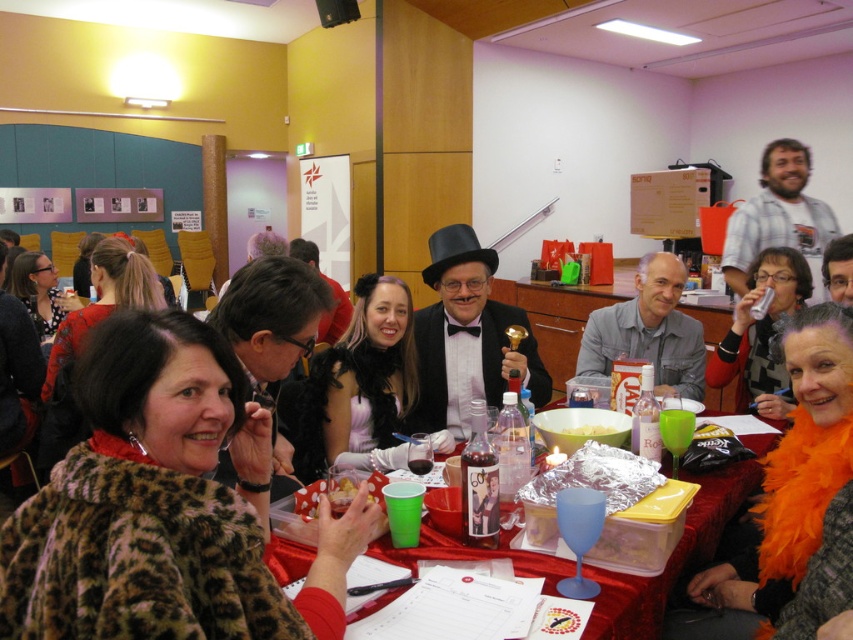
Is matte black dress at center below matte black coat at lower left?

Indeed, matte black dress at center is positioned under matte black coat at lower left.

Can you confirm if matte black dress at center is smaller than matte black coat at lower left?

Yes, matte black dress at center is smaller than matte black coat at lower left.

Which is behind, point (390, 465) or point (62, 308)?

Point (62, 308)

This screenshot has width=853, height=640. In order to click on matte black dress at center in this screenshot , I will do `click(358, 380)`.

Can you confirm if leopard print coat at lower left is thinner than orange feather boa at center?

Incorrect, leopard print coat at lower left's width is not less than orange feather boa at center's.

Is leopard print coat at lower left wider than orange feather boa at center?

Indeed, leopard print coat at lower left has a greater width compared to orange feather boa at center.

Measure the distance between leopard print coat at lower left and camera.

They are 29.46 inches apart.

Find the location of `leopard print coat at lower left`. leopard print coat at lower left is located at coordinates (165, 506).

Between point (640, 625) and point (36, 317), which one is positioned in front?

Positioned in front is point (640, 625).

Is translucent plastic cups at center positioned behind matte black coat at lower left?

No, it is in front of matte black coat at lower left.

The width and height of the screenshot is (853, 640). In order to click on translucent plastic cups at center in this screenshot , I will do `click(672, 556)`.